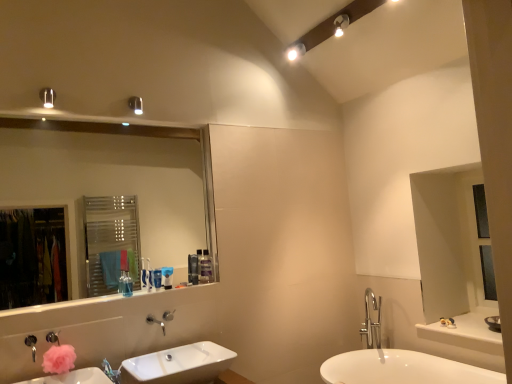
The height and width of the screenshot is (384, 512). Describe the element at coordinates (178, 365) in the screenshot. I see `white glossy sink at lower center, which ranks as the 1th sink in right-to-left order` at that location.

The width and height of the screenshot is (512, 384). In order to click on blue matte toothpaste tube at center, positioned as the fourth toiletry in right-to-left order in this screenshot , I will do `click(157, 278)`.

At what (x,y) coordinates should I click in order to perform the action: click on matte silver light fixture at upper left, the first light fixture when ordered from front to back. Please return your answer as a coordinate pair (x, y). Image resolution: width=512 pixels, height=384 pixels. Looking at the image, I should click on (47, 97).

Find the location of a particular element. white glossy sink at lower center, which appears as the 2th sink when viewed from the left is located at coordinates (178, 365).

From a real-world perspective, which is physically above, translucent plastic toothbrush at center, which is counted as the 5th toiletry, starting from the right, or blue matte toothpaste tube at center, the 4th toiletry in the back-to-front sequence?

translucent plastic toothbrush at center, which is counted as the 5th toiletry, starting from the right, from a real-world perspective.

From the image's perspective, starting from the translucent plastic toothbrush at center, which is counted as the 5th toiletry, starting from the right, which toiletry is the 2nd one below? Please provide its 2D coordinates.

[(157, 278)]

Which of these two, translucent plastic toothbrush at center, which appears as the first toiletry when viewed from the left, or blue matte toothpaste tube at center, the 4th toiletry in the back-to-front sequence, is thinner?

Thinner between the two is blue matte toothpaste tube at center, the 4th toiletry in the back-to-front sequence.

From the image's perspective, between clear glass mirror at upper left and translucent plastic toothbrush at center, which appears as the first toiletry when viewed from the left, which one is located above?

clear glass mirror at upper left is shown above in the image.

Consider the image. Are clear glass mirror at upper left and translucent plastic toothbrush at center, which appears as the first toiletry when viewed from the front, beside each other?

No, clear glass mirror at upper left is not touching translucent plastic toothbrush at center, which appears as the first toiletry when viewed from the front.

This screenshot has width=512, height=384. In order to click on mirror that is on the left side of translucent plastic toothbrush at center, which appears as the first toiletry when viewed from the front in this screenshot , I will do `click(110, 187)`.

Considering the positions of objects matte silver light fixture at upper left, the first light fixture when ordered from front to back, and translucent plastic toothbrush at center, which is counted as the 5th toiletry, starting from the right, in the image provided, who is behind, matte silver light fixture at upper left, the first light fixture when ordered from front to back, or translucent plastic toothbrush at center, which is counted as the 5th toiletry, starting from the right,?

translucent plastic toothbrush at center, which is counted as the 5th toiletry, starting from the right, is further away from the camera.

Considering the sizes of matte silver light fixture at upper left, which ranks as the fourth light fixture in back-to-front order, and translucent plastic toothbrush at center, which appears as the first toiletry when viewed from the left, in the image, is matte silver light fixture at upper left, which ranks as the fourth light fixture in back-to-front order, bigger or smaller than translucent plastic toothbrush at center, which appears as the first toiletry when viewed from the left,?

In the image, matte silver light fixture at upper left, which ranks as the fourth light fixture in back-to-front order, appears to be larger than translucent plastic toothbrush at center, which appears as the first toiletry when viewed from the left.

Which is more to the left, matte silver light fixture at upper left, which is counted as the fourth light fixture, starting from the right, or translucent plastic toothbrush at center, which appears as the first toiletry when viewed from the front?

From the viewer's perspective, matte silver light fixture at upper left, which is counted as the fourth light fixture, starting from the right, appears more on the left side.

Which object is closer to the camera taking this photo, translucent plastic toothbrush at center, which appears as the first toiletry when viewed from the front, or matte silver light fixture at upper left, the first light fixture when ordered from front to back?

matte silver light fixture at upper left, the first light fixture when ordered from front to back, is in front.

Choose the correct answer: Is translucent plastic toothbrush at center, acting as the 5th toiletry starting from the back, inside matte silver light fixture at upper left, arranged as the 1th light fixture when ordered from the bottom, or outside it?

translucent plastic toothbrush at center, acting as the 5th toiletry starting from the back, is outside matte silver light fixture at upper left, arranged as the 1th light fixture when ordered from the bottom.

Is translucent plastic toothbrush at center, which appears as the first toiletry when viewed from the front, aimed at matte silver light fixture at upper left, the first light fixture when ordered from front to back?

No, translucent plastic toothbrush at center, which appears as the first toiletry when viewed from the front, is not facing towards matte silver light fixture at upper left, the first light fixture when ordered from front to back.

From the image's perspective, is translucent plastic toothbrush at center, which appears as the first toiletry when viewed from the front, on matte silver light fixture at upper left, the 1th light fixture in the left-to-right sequence?

No, from the image's perspective, translucent plastic toothbrush at center, which appears as the first toiletry when viewed from the front, is not above matte silver light fixture at upper left, the 1th light fixture in the left-to-right sequence.

From the picture: From the image's perspective, between white glossy sink at lower left, the 1th sink from the left, and clear plastic bottle at center, marked as the 5th toiletry in a front-to-back arrangement, which one is located above?

clear plastic bottle at center, marked as the 5th toiletry in a front-to-back arrangement, from the image's perspective.

You are a GUI agent. You are given a task and a screenshot of the screen. Output one action in this format:
    pyautogui.click(x=<x>, y=<y>)
    Task: Click on the sink that is the 2nd object to the left of the clear plastic bottle at center, which is the 5th toiletry in left-to-right order, starting at the anchor
    This screenshot has width=512, height=384.
    Given the screenshot: What is the action you would take?
    point(73,377)

Which of these two, white glossy sink at lower left, the 2th sink when ordered from right to left, or clear plastic bottle at center, which is the first toiletry in back-to-front order, stands shorter?

white glossy sink at lower left, the 2th sink when ordered from right to left.

Between matte silver light fixture at upper left, which is counted as the fourth light fixture, starting from the right, and clear glass mirror at upper left, which one appears on the left side from the viewer's perspective?

matte silver light fixture at upper left, which is counted as the fourth light fixture, starting from the right.

Can clear glass mirror at upper left be found inside matte silver light fixture at upper left, arranged as the 1th light fixture when ordered from the bottom?

No, clear glass mirror at upper left is not a part of matte silver light fixture at upper left, arranged as the 1th light fixture when ordered from the bottom.

In the scene shown: How much distance is there between matte silver light fixture at upper left, the 1th light fixture in the left-to-right sequence, and clear glass mirror at upper left?

matte silver light fixture at upper left, the 1th light fixture in the left-to-right sequence, is 2.77 meters away from clear glass mirror at upper left.

Which object is thinner, matte silver light fixture at upper left, the 1th light fixture in the left-to-right sequence, or clear glass mirror at upper left?

With smaller width is clear glass mirror at upper left.

Is clear plastic bottle at center, marked as the 5th toiletry in a front-to-back arrangement, smaller than blue plastic toothbrush at upper center, the third toiletry viewed from the left?

No, clear plastic bottle at center, marked as the 5th toiletry in a front-to-back arrangement, is not smaller than blue plastic toothbrush at upper center, the third toiletry viewed from the left.

Based on the photo, looking at their sizes, would you say clear plastic bottle at center, acting as the first toiletry starting from the right, is wider or thinner than blue plastic toothbrush at upper center, the 3th toiletry positioned from the right?

In the image, clear plastic bottle at center, acting as the first toiletry starting from the right, appears to be wider than blue plastic toothbrush at upper center, the 3th toiletry positioned from the right.

How different are the orientations of clear plastic bottle at center, acting as the first toiletry starting from the right, and blue plastic toothbrush at upper center, the 3th toiletry positioned from the right, in degrees?

18.5 degrees.

Considering the relative sizes of clear plastic bottle at center, which is the first toiletry in back-to-front order, and blue plastic toothbrush at upper center, positioned as the third toiletry in front-to-back order, in the image provided, is clear plastic bottle at center, which is the first toiletry in back-to-front order, shorter than blue plastic toothbrush at upper center, positioned as the third toiletry in front-to-back order,?

Incorrect, the height of clear plastic bottle at center, which is the first toiletry in back-to-front order, does not fall short of that of blue plastic toothbrush at upper center, positioned as the third toiletry in front-to-back order.

Where is `toiletry that is the 2nd one below the translucent plastic toothbrush at center, which appears as the first toiletry when viewed from the front (from a real-world perspective)`? toiletry that is the 2nd one below the translucent plastic toothbrush at center, which appears as the first toiletry when viewed from the front (from a real-world perspective) is located at coordinates (157, 278).

Find the location of a particular element. The height and width of the screenshot is (384, 512). mirror on the left side of translucent plastic toothbrush at center, acting as the 5th toiletry starting from the back is located at coordinates (110, 187).

From the image, which object appears to be farther from white glossy sink at lower left, the 1th sink from the left, translucent plastic toothbrush at center, acting as the 5th toiletry starting from the back, or white glossy sink at lower center, which ranks as the 1th sink in right-to-left order?

Among the two, translucent plastic toothbrush at center, acting as the 5th toiletry starting from the back, is located further to white glossy sink at lower left, the 1th sink from the left.

Based on their spatial positions, is white glossy counter top at lower right or satin black soap dispenser at upper center, which is counted as the 4th toiletry, starting from the front, closer to white glossy sink at lower left, the 1th sink from the left?

The object closer to white glossy sink at lower left, the 1th sink from the left, is satin black soap dispenser at upper center, which is counted as the 4th toiletry, starting from the front.

When comparing their distances from translucent plastic toothbrush at center, which appears as the first toiletry when viewed from the front, does blue matte toothpaste tube at center, the second toiletry positioned from the left, or clear plastic bottle at center, marked as the 5th toiletry in a front-to-back arrangement, seem closer?

Answer: blue matte toothpaste tube at center, the second toiletry positioned from the left.

When comparing their distances from white glossy spot light at upper center, positioned as the first light fixture in back-to-front order, does pink fluffy flower at lower left or white glossy counter top at lower right seem closer?

white glossy counter top at lower right lies closer to white glossy spot light at upper center, positioned as the first light fixture in back-to-front order, than the other object.

From the image, which object appears to be nearer to white glossy sink at lower center, which appears as the 2th sink when viewed from the left, brushed metal faucet at lower left or blue matte toothpaste tube at center, the 4th toiletry in the back-to-front sequence?

blue matte toothpaste tube at center, the 4th toiletry in the back-to-front sequence, is positioned closer to the anchor white glossy sink at lower center, which appears as the 2th sink when viewed from the left.

From the image, which object appears to be nearer to clear glass mirror at upper left, white glossy sink at lower left, the 2th sink when ordered from right to left, or white glossy spot light at upper center, positioned as the first light fixture in back-to-front order?

white glossy spot light at upper center, positioned as the first light fixture in back-to-front order, is closer to clear glass mirror at upper left.

When comparing their distances from white glossy sink at lower center, which ranks as the 1th sink in right-to-left order, does brushed metal faucet at lower center or brushed metal faucet at lower left seem further?

brushed metal faucet at lower left is positioned further to the anchor white glossy sink at lower center, which ranks as the 1th sink in right-to-left order.

Estimate the real-world distances between objects in this image. Which object is closer to clear plastic bottle at center, acting as the first toiletry starting from the right, white glossy sink at lower center, which ranks as the 1th sink in right-to-left order, or metallic cylindrical light fixture at upper left, the 2th light fixture in the bottom-to-top sequence?

white glossy sink at lower center, which ranks as the 1th sink in right-to-left order, is positioned closer to the anchor clear plastic bottle at center, acting as the first toiletry starting from the right.

You are a GUI agent. You are given a task and a screenshot of the screen. Output one action in this format:
    pyautogui.click(x=<x>, y=<y>)
    Task: Click on the flower between clear glass mirror at upper left and white glossy sink at lower left, the 2th sink when ordered from right to left, in the vertical direction
    The height and width of the screenshot is (384, 512).
    Given the screenshot: What is the action you would take?
    pyautogui.click(x=59, y=359)

Find the location of a particular element. The image size is (512, 384). mirror between matte silver light fixture at upper left, which is counted as the fourth light fixture, starting from the right, and blue plastic toothbrush at upper center, the third toiletry viewed from the left, in the vertical direction is located at coordinates (110, 187).

The height and width of the screenshot is (384, 512). I want to click on plumbing fixture positioned between white glossy sink at lower center, which ranks as the 1th sink in right-to-left order, and satin black soap dispenser at upper center, which appears as the fourth toiletry when viewed from the left, from near to far, so click(52, 337).

Find the location of a particular element. tap located between white glossy sink at lower left, the 1th sink from the left, and blue plastic toothbrush at upper center, which ranks as the third toiletry in back-to-front order, in the depth direction is located at coordinates (156, 322).